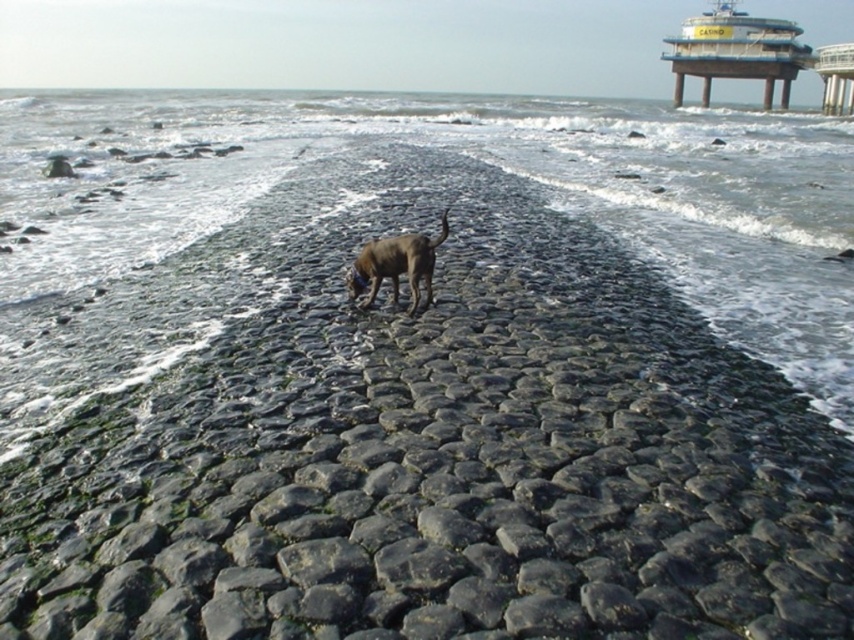
You are standing at the edge of the cobblestone path and see the dog and the clear water at center. How far apart are they?

The dog and the clear water at center are 11.58 feet apart.

You are a photographer standing at the starting point of the cobblestone path. You want to capture a photo of the brown matte dog at center and the metallic gray pier at upper right in the same frame. Given that your camera has a maximum zoom range of 50 meters, can you fit both objects into the frame without moving closer?

The brown matte dog at center and the metallic gray pier at upper right are 54.41 meters apart. Since the maximum zoom range is 50 meters, the distance between them exceeds the camera capability, so you cannot fit both into the frame without moving closer.